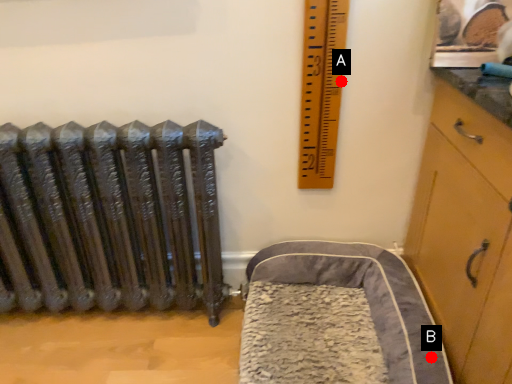
Question: Two points are circled on the image, labeled by A and B beside each circle. Which point appears closest to the camera in this image?

Choices:
 (A) A is closer
 (B) B is closer

Answer: (B)